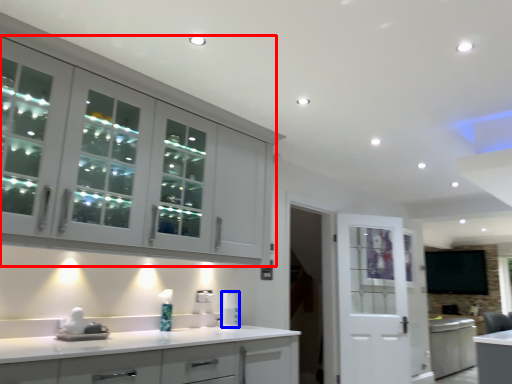
Question: Among these objects, which one is farthest to the camera, cabinetry (highlighted by a red box) or appliance (highlighted by a blue box)?

Choices:
 (A) cabinetry
 (B) appliance

Answer: (B)